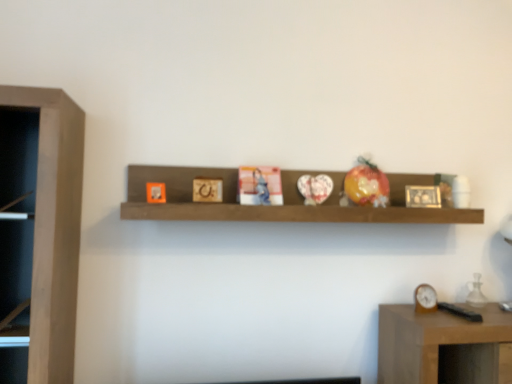
Question: From the image's perspective, is brown wooden clock at right on top of brown wooden shelf at center?

Choices:
 (A) yes
 (B) no

Answer: (B)

Question: Can you confirm if brown wooden clock at right is bigger than brown wooden shelf at center?

Choices:
 (A) yes
 (B) no

Answer: (B)

Question: Is brown wooden clock at right thinner than brown wooden shelf at center?

Choices:
 (A) yes
 (B) no

Answer: (A)

Question: Is brown wooden shelf at center surrounded by brown wooden clock at right?

Choices:
 (A) yes
 (B) no

Answer: (B)

Question: Is brown wooden clock at right far away from brown wooden shelf at center?

Choices:
 (A) no
 (B) yes

Answer: (A)

Question: Is wooden picture frame at center wider or thinner than brown wooden clock at right?

Choices:
 (A) thin
 (B) wide

Answer: (B)

Question: Visually, is wooden picture frame at center positioned to the left or to the right of brown wooden clock at right?

Choices:
 (A) left
 (B) right

Answer: (A)

Question: Is wooden picture frame at center inside the boundaries of brown wooden clock at right, or outside?

Choices:
 (A) outside
 (B) inside

Answer: (A)

Question: From the image's perspective, is wooden picture frame at center above or below brown wooden clock at right?

Choices:
 (A) below
 (B) above

Answer: (B)

Question: Would you say brown wooden clock at right is to the left or to the right of brown wooden shelf at center in the picture?

Choices:
 (A) left
 (B) right

Answer: (B)

Question: Considering the positions of brown wooden clock at right and brown wooden shelf at center in the image, is brown wooden clock at right taller or shorter than brown wooden shelf at center?

Choices:
 (A) tall
 (B) short

Answer: (B)

Question: Is brown wooden clock at right inside the boundaries of brown wooden shelf at center, or outside?

Choices:
 (A) inside
 (B) outside

Answer: (B)

Question: From a real-world perspective, is brown wooden clock at right above or below brown wooden shelf at center?

Choices:
 (A) above
 (B) below

Answer: (B)

Question: From the image's perspective, is wooden picture frame at center positioned above or below brown wooden shelf at center?

Choices:
 (A) above
 (B) below

Answer: (B)

Question: In the image, is wooden picture frame at center positioned in front of or behind brown wooden shelf at center?

Choices:
 (A) behind
 (B) front

Answer: (A)